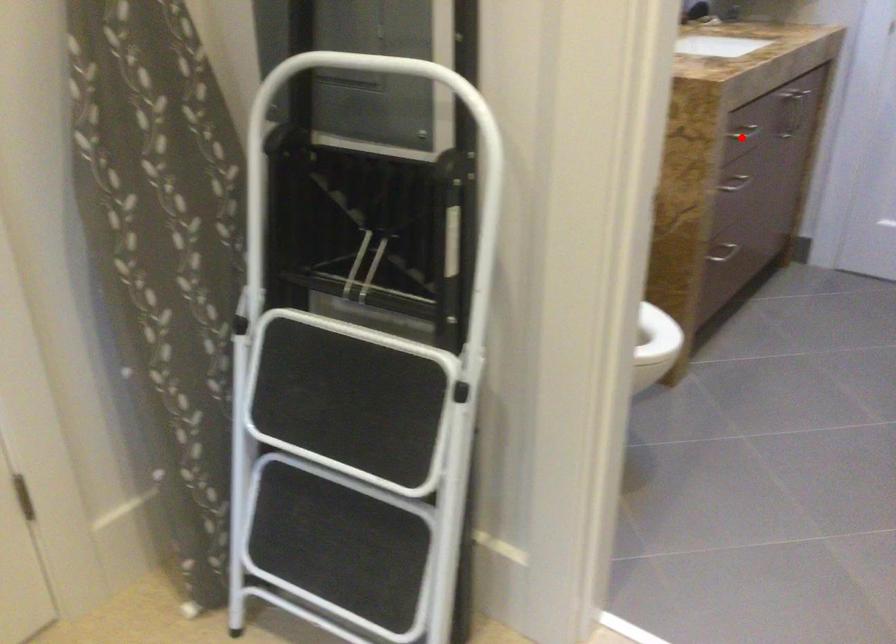
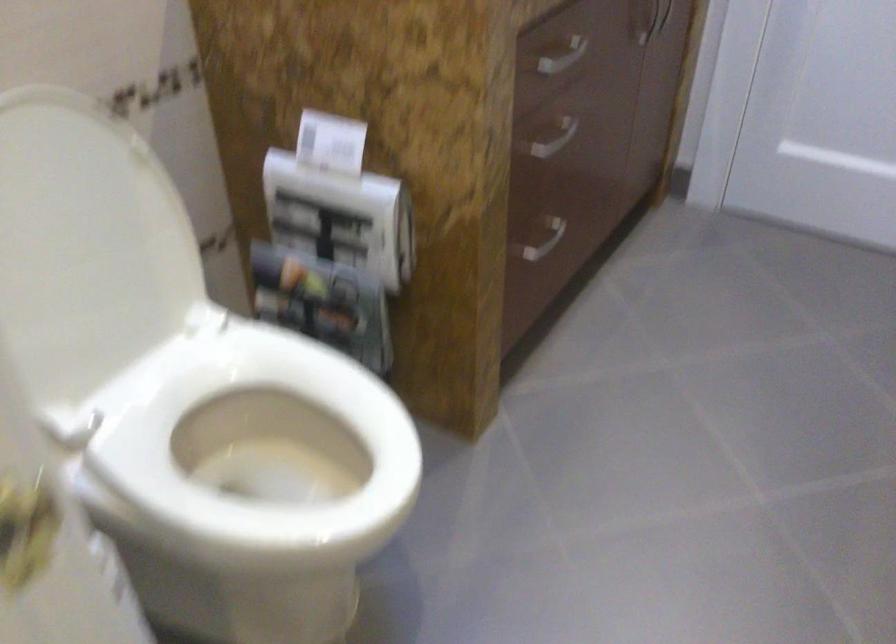
Locate, in the second image, the point that corresponds to the highlighted location in the first image.

(562, 57)